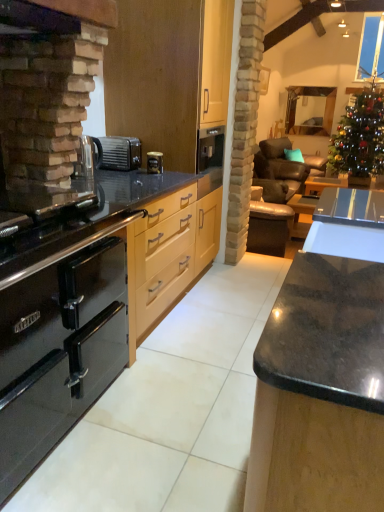
Question: Is black matte toaster at center spatially inside transparent glass window at upper right, or outside of it?

Choices:
 (A) inside
 (B) outside

Answer: (B)

Question: In terms of size, does black matte toaster at center appear bigger or smaller than transparent glass window at upper right?

Choices:
 (A) small
 (B) big

Answer: (A)

Question: Estimate the real-world distances between objects in this image. Which object is closer to the leather armchair at center?

Choices:
 (A) black polished granite countertop at center, which appears as the 1th cabinetry when viewed from the right
 (B) leather at right
 (C) green glittering christmas tree at upper right
 (D) light wood cabinetry at center, the second cabinetry from the right
 (E) metallic silver coffee machine at center

Answer: (B)

Question: Based on their relative distances, which object is farther from the leather armchair at center?

Choices:
 (A) light wood cabinetry at center, marked as the 2th cabinetry in a left-to-right arrangement
 (B) green glittering christmas tree at upper right
 (C) black matte toaster at center
 (D) black glass countertop at left
 (E) metallic silver coffee machine at center

Answer: (D)